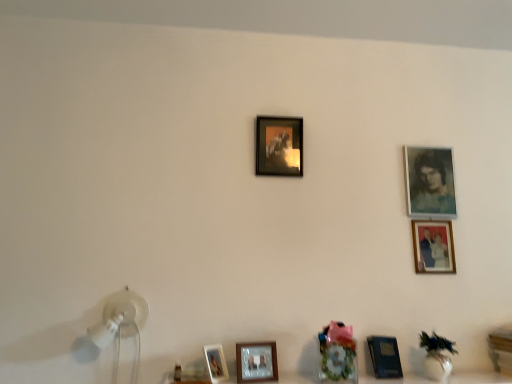
Question: Is wooden table at lower right further to the viewer compared to white glossy table lamp at lower left?

Choices:
 (A) yes
 (B) no

Answer: (A)

Question: Is wooden table at lower right shorter than white glossy table lamp at lower left?

Choices:
 (A) no
 (B) yes

Answer: (B)

Question: From the image's perspective, does wooden table at lower right appear lower than white glossy table lamp at lower left?

Choices:
 (A) no
 (B) yes

Answer: (B)

Question: Can white glossy table lamp at lower left be found inside wooden table at lower right?

Choices:
 (A) no
 (B) yes

Answer: (A)

Question: Considering the relative positions of wooden table at lower right and white glossy table lamp at lower left in the image provided, is wooden table at lower right in front of white glossy table lamp at lower left?

Choices:
 (A) yes
 (B) no

Answer: (B)

Question: Looking at their shapes, would you say matte glass photo frame at lower center, which appears as the second picture frame when ordered from the bottom, is wider or thinner than wooden table at lower right?

Choices:
 (A) wide
 (B) thin

Answer: (B)

Question: Is point (224, 364) closer or farther from the camera than point (509, 339)?

Choices:
 (A) closer
 (B) farther

Answer: (A)

Question: Would you say matte glass photo frame at lower center, acting as the 5th picture frame starting from the top, is to the left or to the right of wooden table at lower right in the picture?

Choices:
 (A) right
 (B) left

Answer: (B)

Question: Is matte glass photo frame at lower center, the 1th picture frame when ordered from left to right, bigger or smaller than wooden table at lower right?

Choices:
 (A) small
 (B) big

Answer: (A)

Question: In the image, is wooden table at lower right positioned in front of or behind matte glass photo frame at lower center, which is the sixth picture frame from right to left?

Choices:
 (A) behind
 (B) front

Answer: (A)

Question: Is wooden table at lower right situated inside matte glass photo frame at lower center, acting as the 5th picture frame starting from the top, or outside?

Choices:
 (A) outside
 (B) inside

Answer: (A)

Question: Considering the positions of point (498, 337) and point (220, 360), is point (498, 337) closer or farther from the camera than point (220, 360)?

Choices:
 (A) closer
 (B) farther

Answer: (B)

Question: Considering the relative positions of wooden table at lower right and matte glass photo frame at lower center, which is the sixth picture frame from right to left, in the image provided, is wooden table at lower right to the left or to the right of matte glass photo frame at lower center, which is the sixth picture frame from right to left,?

Choices:
 (A) right
 (B) left

Answer: (A)

Question: From a real-world perspective, relative to matte black picture frame at center, the sixth picture frame ordered from the bottom, is blue textured portrait at upper right, acting as the fifth picture frame starting from the bottom, vertically above or below?

Choices:
 (A) above
 (B) below

Answer: (B)

Question: Relative to matte black picture frame at center, the 4th picture frame positioned from the right, is blue textured portrait at upper right, acting as the fifth picture frame starting from the bottom, in front or behind?

Choices:
 (A) behind
 (B) front

Answer: (A)